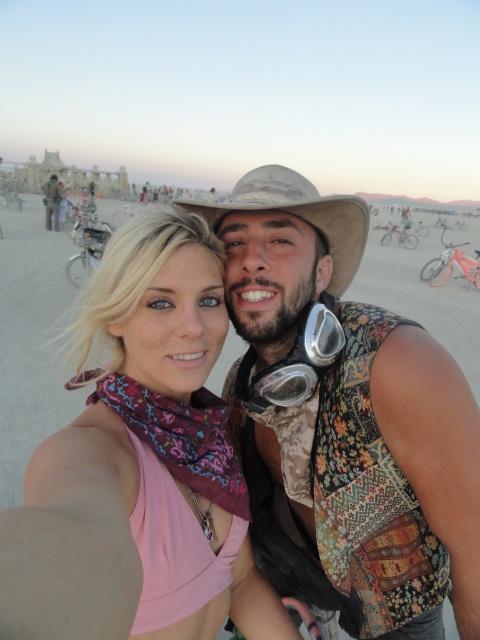
Question: Is floral patchwork vest at center wider than pink fabric scarf at center?

Choices:
 (A) yes
 (B) no

Answer: (A)

Question: Considering the relative positions of pink fabric scarf at center and brown fabric cowboy hat at center in the image provided, where is pink fabric scarf at center located with respect to brown fabric cowboy hat at center?

Choices:
 (A) below
 (B) above

Answer: (A)

Question: Is floral patchwork vest at center below matte black jacket at upper left?

Choices:
 (A) yes
 (B) no

Answer: (A)

Question: Which point appears closest to the camera in this image?

Choices:
 (A) (51, 225)
 (B) (239, 225)

Answer: (B)

Question: Among these objects, which one is nearest to the camera?

Choices:
 (A) matte black jacket at upper left
 (B) pink fabric scarf at center

Answer: (B)

Question: Which point appears closest to the camera in this image?

Choices:
 (A) (446, 436)
 (B) (131, 358)
 (C) (354, 250)

Answer: (A)